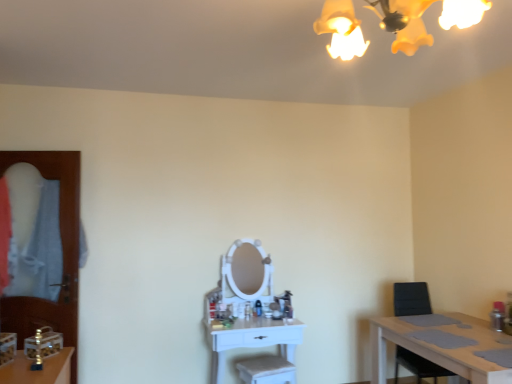
Question: From a real-world perspective, is white glossy vanity at center, placed as the 2th table when sorted from right to left, physically located above or below light brown wooden table at lower right, acting as the 1th table starting from the right?

Choices:
 (A) above
 (B) below

Answer: (B)

Question: Considering the positions of point (256, 370) and point (424, 350), is point (256, 370) closer or farther from the camera than point (424, 350)?

Choices:
 (A) closer
 (B) farther

Answer: (B)

Question: Considering the real-world distances, which object is farthest from the light brown wooden table at lower right, the second table in the left-to-right sequence?

Choices:
 (A) yellow matte light fixture at upper center
 (B) black plastic chair at right
 (C) white glossy vanity at center, the 1th table from the left
 (D) transparent wooden door at left

Answer: (D)

Question: Estimate the real-world distances between objects in this image. Which object is closer to the black plastic chair at right?

Choices:
 (A) white glossy vanity at center, the 1th table from the left
 (B) light brown wooden table at lower right, acting as the 1th table starting from the right
 (C) yellow matte light fixture at upper center
 (D) transparent wooden door at left

Answer: (B)